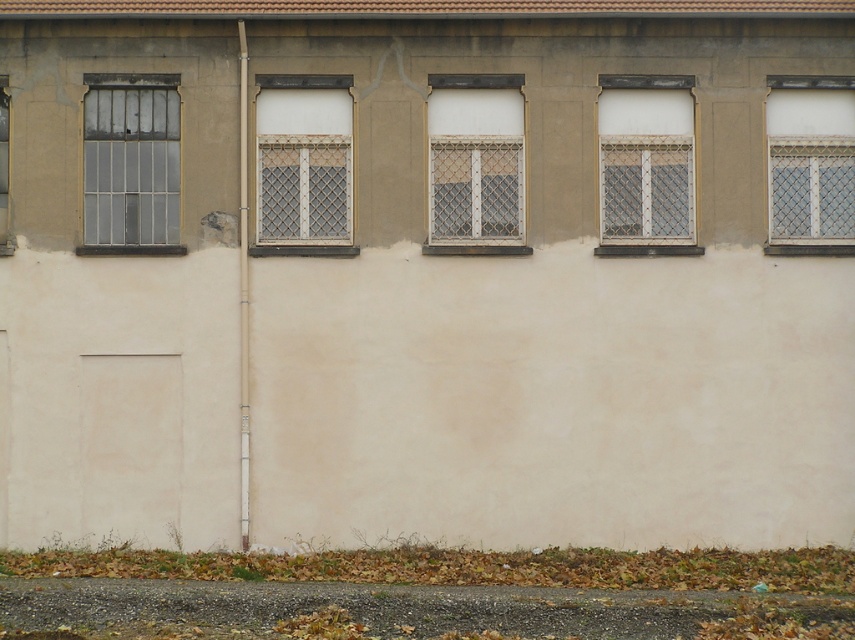
Question: Which of these objects is positioned farthest from the clear glass window at left?

Choices:
 (A) white mesh screen at upper right
 (B) white textured window at center right

Answer: (A)

Question: Is white textured window at center right to the left of white mesh screen at upper right from the viewer's perspective?

Choices:
 (A) no
 (B) yes

Answer: (B)

Question: Is white textured window at center right bigger than white textured window at center?

Choices:
 (A) yes
 (B) no

Answer: (A)

Question: Among these points, which one is nearest to the camera?

Choices:
 (A) (4, 93)
 (B) (774, 182)

Answer: (A)

Question: Is the position of white mesh screen at upper right less distant than that of clear glass window at left?

Choices:
 (A) yes
 (B) no

Answer: (B)

Question: Which point appears closest to the camera in this image?

Choices:
 (A) (834, 172)
 (B) (688, 220)
 (C) (503, 243)
 (D) (174, 145)

Answer: (C)